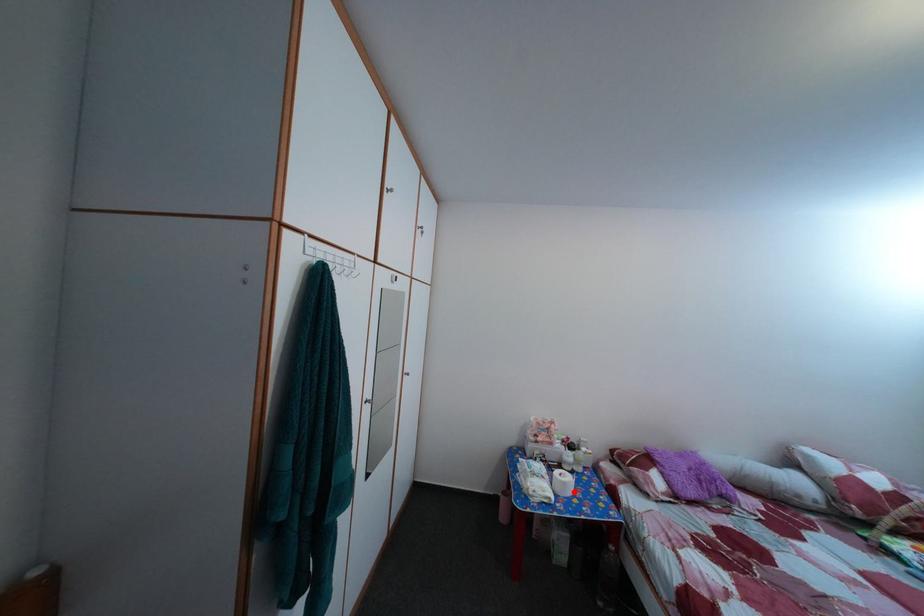
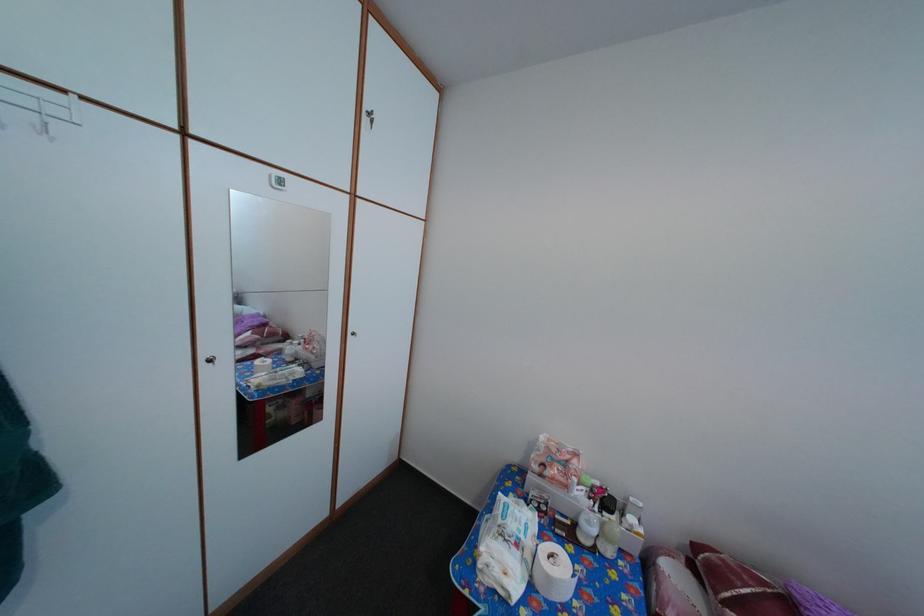
Question: I am providing you with two images of the same scene from different viewpoints. A red point is marked on the first image. Is the red point's position out of view in image 2?

Choices:
 (A) Yes
 (B) No

Answer: (B)